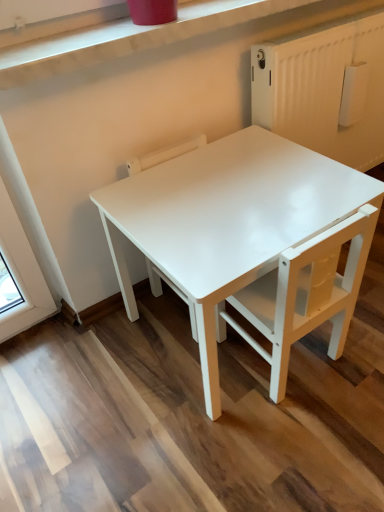
I want to click on white glossy table at center, so 227,220.

From the picture: Can you confirm if white glossy chair at center, which is the 2th chair in right-to-left order, is positioned to the left of white matte chair at center, which is the 2th chair in left-to-right order?

Yes, white glossy chair at center, which is the 2th chair in right-to-left order, is to the left of white matte chair at center, which is the 2th chair in left-to-right order.

Is white matte chair at center, which is the 2th chair in left-to-right order, a part of white glossy chair at center, which appears as the first chair when viewed from the left?

No.

From a real-world perspective, between white glossy chair at center, which appears as the first chair when viewed from the left, and white matte chair at center, which appears as the 1th chair when viewed from the right, who is vertically higher?

In real-world perspective, white glossy chair at center, which appears as the first chair when viewed from the left, is above.

This screenshot has width=384, height=512. What are the coordinates of `table that is below the white glossy chair at center, which appears as the first chair when viewed from the left (from the image's perspective)` in the screenshot? It's located at (227, 220).

Is white glossy chair at center, which appears as the first chair when viewed from the left, in contact with white glossy table at center?

No, white glossy chair at center, which appears as the first chair when viewed from the left, is not touching white glossy table at center.

Is white glossy chair at center, which appears as the first chair when viewed from the left, facing towards white glossy table at center?

Yes, white glossy chair at center, which appears as the first chair when viewed from the left, is aimed at white glossy table at center.

Does white glossy chair at center, which is the 2th chair in right-to-left order, lie behind white glossy table at center?

Yes, the depth of white glossy chair at center, which is the 2th chair in right-to-left order, is greater than that of white glossy table at center.

Which is behind, white matte chair at center, which appears as the 1th chair when viewed from the right, or white glossy chair at center, which is the 2th chair in right-to-left order?

Positioned behind is white glossy chair at center, which is the 2th chair in right-to-left order.

Is white matte chair at center, which is the 2th chair in left-to-right order, far away from white glossy chair at center, which appears as the first chair when viewed from the left?

No, there isn't a large distance between white matte chair at center, which is the 2th chair in left-to-right order, and white glossy chair at center, which appears as the first chair when viewed from the left.

Can white glossy chair at center, which is the 2th chair in right-to-left order, be found inside white matte chair at center, which is the 2th chair in left-to-right order?

That's incorrect, white glossy chair at center, which is the 2th chair in right-to-left order, is not inside white matte chair at center, which is the 2th chair in left-to-right order.

How distant is white glossy table at center from white matte chair at center, which appears as the 1th chair when viewed from the right?

white glossy table at center and white matte chair at center, which appears as the 1th chair when viewed from the right, are 7.99 inches apart from each other.

Does white glossy table at center have a greater height compared to white matte chair at center, which appears as the 1th chair when viewed from the right?

Correct, white glossy table at center is much taller as white matte chair at center, which appears as the 1th chair when viewed from the right.

Is white glossy table at center next to white matte chair at center, which appears as the 1th chair when viewed from the right?

No, white glossy table at center is not in contact with white matte chair at center, which appears as the 1th chair when viewed from the right.

Considering the sizes of white glossy table at center and white matte chair at center, which appears as the 1th chair when viewed from the right, in the image, is white glossy table at center bigger or smaller than white matte chair at center, which appears as the 1th chair when viewed from the right,?

white glossy table at center is bigger than white matte chair at center, which appears as the 1th chair when viewed from the right.

Considering the relative sizes of white glossy table at center and white glossy chair at center, which appears as the first chair when viewed from the left, in the image provided, is white glossy table at center smaller than white glossy chair at center, which appears as the first chair when viewed from the left,?

No.

Is point (191, 290) closer or farther from the camera than point (193, 308)?

Point (191, 290) appears to be closer to the viewer than point (193, 308).

Between white glossy table at center and white glossy chair at center, which appears as the first chair when viewed from the left, which one has smaller width?

Thinner between the two is white glossy chair at center, which appears as the first chair when viewed from the left.

From their relative heights in the image, would you say white glossy table at center is taller or shorter than white glossy chair at center, which is the 2th chair in right-to-left order?

white glossy table at center is taller than white glossy chair at center, which is the 2th chair in right-to-left order.

Who is taller, white matte chair at center, which appears as the 1th chair when viewed from the right, or white glossy table at center?

Standing taller between the two is white glossy table at center.

Does point (251, 312) appear closer or farther from the camera than point (171, 272)?

Clearly, point (251, 312) is more distant from the camera than point (171, 272).

From the image's perspective, would you say white matte chair at center, which appears as the 1th chair when viewed from the right, is shown under white glossy table at center?

Yes, from the image's perspective, white matte chair at center, which appears as the 1th chair when viewed from the right, is below white glossy table at center.

Find the location of a particular element. This screenshot has width=384, height=512. chair in front of the white glossy chair at center, which is the 2th chair in right-to-left order is located at coordinates (306, 294).

The height and width of the screenshot is (512, 384). In order to click on table on the right of white glossy chair at center, which is the 2th chair in right-to-left order in this screenshot , I will do [x=227, y=220].

Based on the photo, when comparing their distances from white matte chair at center, which appears as the 1th chair when viewed from the right, does white glossy table at center or white glossy chair at center, which is the 2th chair in right-to-left order, seem closer?

white glossy table at center is positioned closer to the anchor white matte chair at center, which appears as the 1th chair when viewed from the right.

Looking at the image, which one is located closer to white glossy table at center, white glossy chair at center, which is the 2th chair in right-to-left order, or white matte chair at center, which is the 2th chair in left-to-right order?

The object closer to white glossy table at center is white matte chair at center, which is the 2th chair in left-to-right order.

When comparing their distances from white glossy table at center, does white matte chair at center, which appears as the 1th chair when viewed from the right, or white glossy chair at center, which appears as the first chair when viewed from the left, seem further?

Based on the image, white glossy chair at center, which appears as the first chair when viewed from the left, appears to be further to white glossy table at center.

Looking at the image, which one is located further to white glossy chair at center, which is the 2th chair in right-to-left order, white matte chair at center, which is the 2th chair in left-to-right order, or white glossy table at center?

Based on the image, white glossy table at center appears to be further to white glossy chair at center, which is the 2th chair in right-to-left order.

Looking at the image, which one is located closer to white matte chair at center, which is the 2th chair in left-to-right order, white glossy chair at center, which appears as the first chair when viewed from the left, or white glossy table at center?

Based on the image, white glossy table at center appears to be nearer to white matte chair at center, which is the 2th chair in left-to-right order.

From the image, which object appears to be farther from white glossy chair at center, which appears as the first chair when viewed from the left, white glossy table at center or white matte chair at center, which is the 2th chair in left-to-right order?

white glossy table at center is further to white glossy chair at center, which appears as the first chair when viewed from the left.

You are a GUI agent. You are given a task and a screenshot of the screen. Output one action in this format:
    pyautogui.click(x=<x>, y=<y>)
    Task: Click on the table between white glossy chair at center, which appears as the first chair when viewed from the left, and white matte chair at center, which appears as the 1th chair when viewed from the right, vertically
    This screenshot has height=512, width=384.
    Given the screenshot: What is the action you would take?
    pyautogui.click(x=227, y=220)